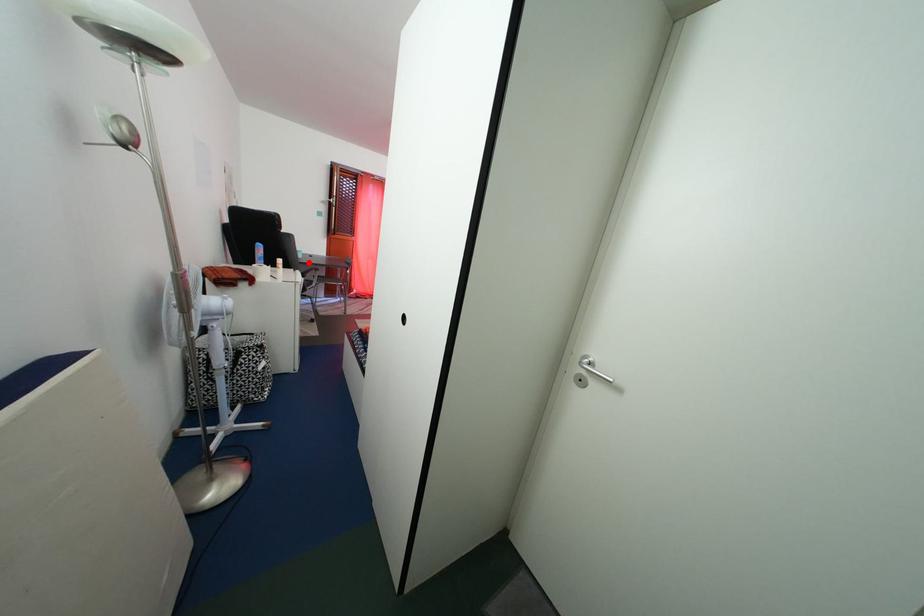
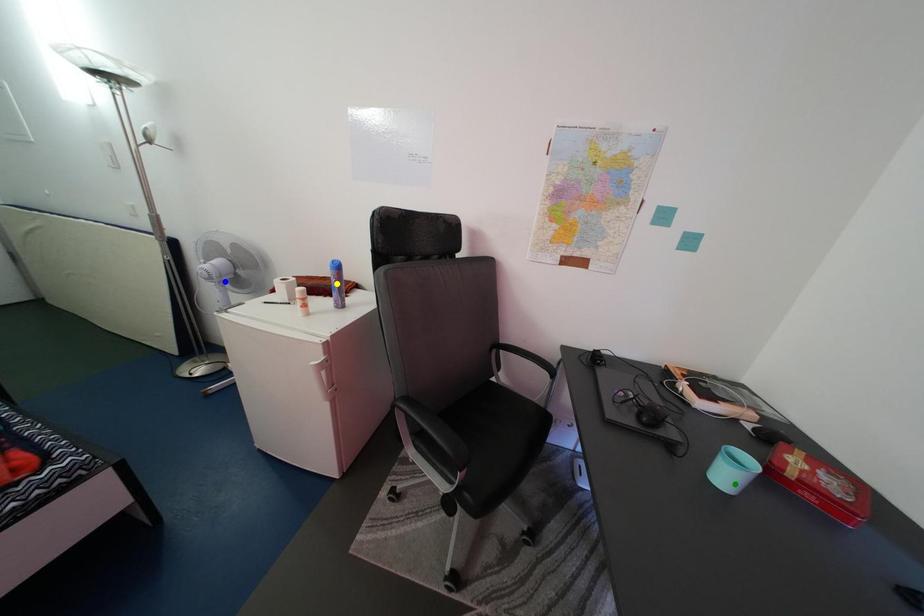
Question: I am providing you with two images of the same scene from different viewpoints. A red point is marked on the first image. You are given multiple points on the second image. Which point in image 2 represents the same 3d spot as the red point in image 1?

Choices:
 (A) green point
 (B) blue point
 (C) yellow point

Answer: (A)